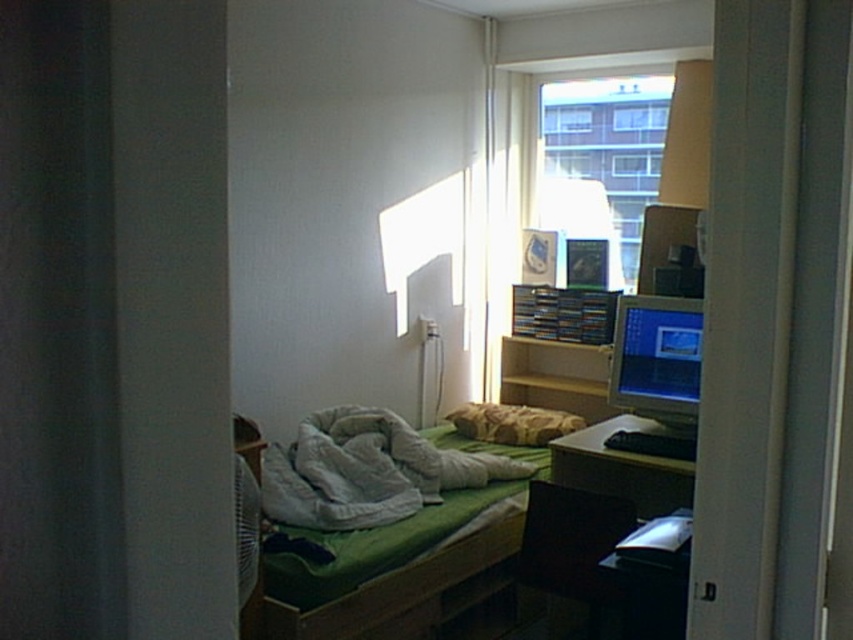
You are organizing the dorm room and need to move the wooden bookshelf at center closer to the desk. Which direction should you move it from the patterned fabric pillow at center?

The wooden bookshelf at center is currently on the right side of the patterned fabric pillow at center. To move it closer to the desk, you should move it to the left away from the desk.

Looking at this image, what is the 2D coordinate of the black plastic computer desk at lower right?

The black plastic computer desk at lower right is located at the 2D coordinate point of (619, 467).